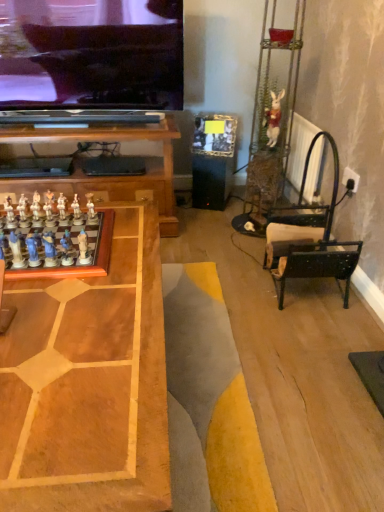
This screenshot has height=512, width=384. Find the location of `free location in front of matte blue chess piece at left, the eighth toy in the right-to-left sequence`. free location in front of matte blue chess piece at left, the eighth toy in the right-to-left sequence is located at coordinates (31, 292).